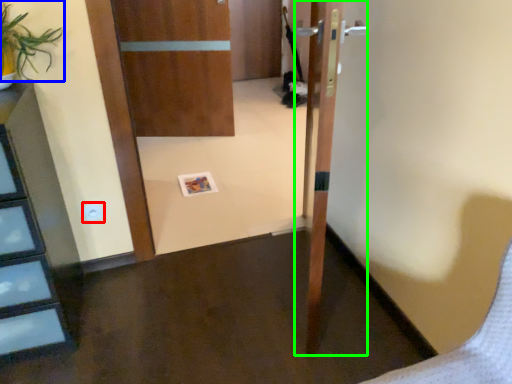
Question: Based on their relative distances, which object is nearer to electric outlet (highlighted by a red box)? Choose from plant (highlighted by a blue box) and door (highlighted by a green box).

Choices:
 (A) plant
 (B) door

Answer: (A)